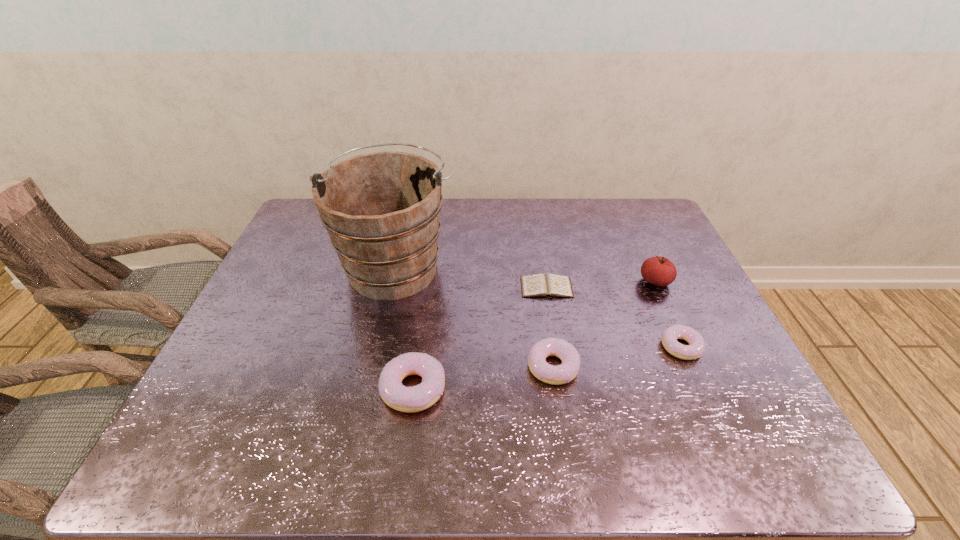
Where is `free space between the shortest doughnut and the bucket`? Image resolution: width=960 pixels, height=540 pixels. free space between the shortest doughnut and the bucket is located at coordinates (539, 306).

I want to click on vacant region between the third tallest object and the fifth shortest object, so click(535, 335).

Identify the location of empty location between the leftmost doughnut and the fifth shortest object. click(x=535, y=335).

Locate which object is the fifth closest to the tallest doughnut. Please provide its 2D coordinates. Your answer should be formatted as a tuple, i.e. [(x, y)], where the tuple contains the x and y coordinates of a point satisfying the conditions above.

[(659, 271)]

Choose which object is the second nearest neighbor to the tallest object. Please provide its 2D coordinates. Your answer should be formatted as a tuple, i.e. [(x, y)], where the tuple contains the x and y coordinates of a point satisfying the conditions above.

[(548, 285)]

Point out which doughnut is positioned as the third nearest to the tomato. Please provide its 2D coordinates. Your answer should be formatted as a tuple, i.e. [(x, y)], where the tuple contains the x and y coordinates of a point satisfying the conditions above.

[(397, 396)]

You are a GUI agent. You are given a task and a screenshot of the screen. Output one action in this format:
    pyautogui.click(x=<x>, y=<y>)
    Task: Click on the second closest doughnut to the bucket
    The image size is (960, 540).
    Given the screenshot: What is the action you would take?
    pyautogui.click(x=565, y=372)

This screenshot has width=960, height=540. I want to click on free region that satisfies the following two spatial constraints: 1. on the back side of the fifth shortest object; 2. on the left side of the second shortest object, so click(x=652, y=281).

Where is `free space that satisfies the following two spatial constraints: 1. on the back side of the fifth shortest object; 2. on the right side of the second doughnut from right to left`? free space that satisfies the following two spatial constraints: 1. on the back side of the fifth shortest object; 2. on the right side of the second doughnut from right to left is located at coordinates (540, 281).